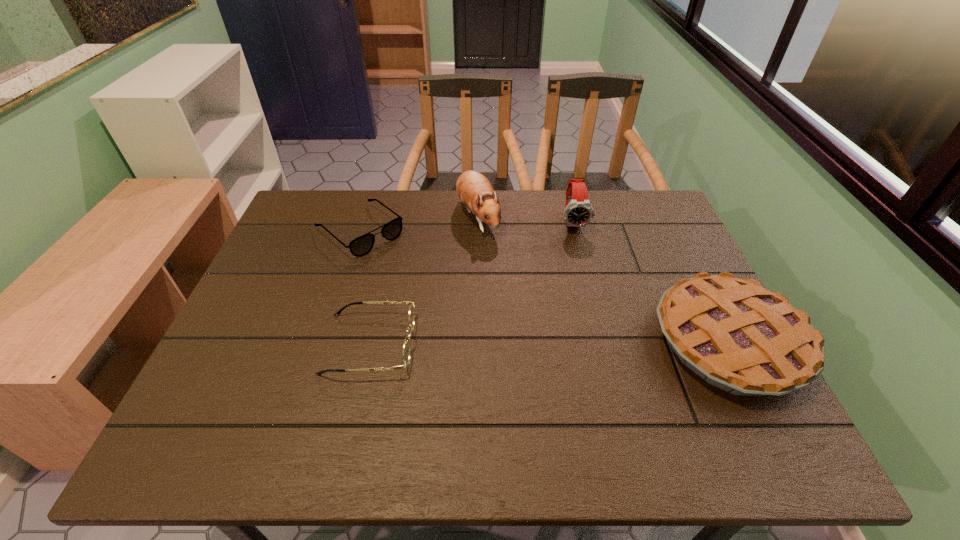
Locate an element on the screen. The image size is (960, 540). free space between the hamster and the nearer spectacles is located at coordinates (423, 280).

Identify the location of free area in between the third object from right to left and the nearer spectacles. This screenshot has height=540, width=960. (423, 280).

This screenshot has width=960, height=540. What are the coordinates of `free space between the watch and the farther spectacles` in the screenshot? It's located at (467, 226).

The image size is (960, 540). I want to click on vacant space that's between the pie and the nearer spectacles, so click(x=549, y=342).

Image resolution: width=960 pixels, height=540 pixels. I want to click on free space between the pie and the farther spectacles, so [544, 286].

Identify the location of vacant space in between the watch and the third object from left to right. (525, 219).

Locate an element on the screen. The width and height of the screenshot is (960, 540). free space between the rightmost object and the farther spectacles is located at coordinates coord(544,286).

Locate an element on the screen. vacant area that lies between the pie and the third object from left to right is located at coordinates (604, 279).

Locate an element on the screen. This screenshot has height=540, width=960. free space that is in between the rightmost object and the hamster is located at coordinates (604, 279).

At what (x,y) coordinates should I click in order to perform the action: click on the fourth closest object to the hamster. Please return your answer as a coordinate pair (x, y). Looking at the image, I should click on point(738,336).